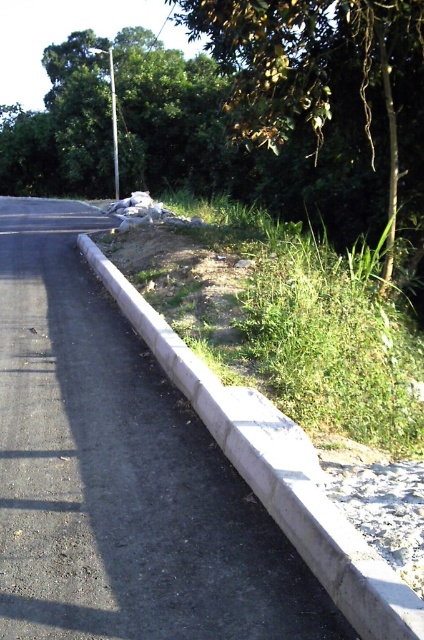
Measure the distance from green leafy tree at upper center to gray concrete curb at center.

green leafy tree at upper center and gray concrete curb at center are 14.14 meters apart.

Who is shorter, green leafy tree at upper center or gray concrete curb at center?

gray concrete curb at center is shorter.

Consider the image. Who is more forward, (415, 26) or (329, 532)?

Positioned in front is point (329, 532).

Identify the location of green leafy tree at upper center. Image resolution: width=424 pixels, height=640 pixels. (329, 102).

Is green leafy tree at upper center shorter than metallic pole at upper center?

Incorrect, green leafy tree at upper center's height does not fall short of metallic pole at upper center's.

Between green leafy tree at upper center and metallic pole at upper center, which one appears on the right side from the viewer's perspective?

green leafy tree at upper center

The width and height of the screenshot is (424, 640). What do you see at coordinates (329, 102) in the screenshot?
I see `green leafy tree at upper center` at bounding box center [329, 102].

You are a GUI agent. You are given a task and a screenshot of the screen. Output one action in this format:
    pyautogui.click(x=<x>, y=<y>)
    Task: Click on the green leafy tree at upper center
    The image size is (424, 640).
    Given the screenshot: What is the action you would take?
    pyautogui.click(x=329, y=102)

This screenshot has height=640, width=424. I want to click on gray concrete curb at center, so click(x=276, y=472).

Does gray concrete curb at center appear on the left side of metallic pole at upper center?

No, gray concrete curb at center is not to the left of metallic pole at upper center.

You are a GUI agent. You are given a task and a screenshot of the screen. Output one action in this format:
    pyautogui.click(x=<x>, y=<y>)
    Task: Click on the gray concrete curb at center
    Image resolution: width=424 pixels, height=640 pixels.
    Given the screenshot: What is the action you would take?
    pyautogui.click(x=276, y=472)